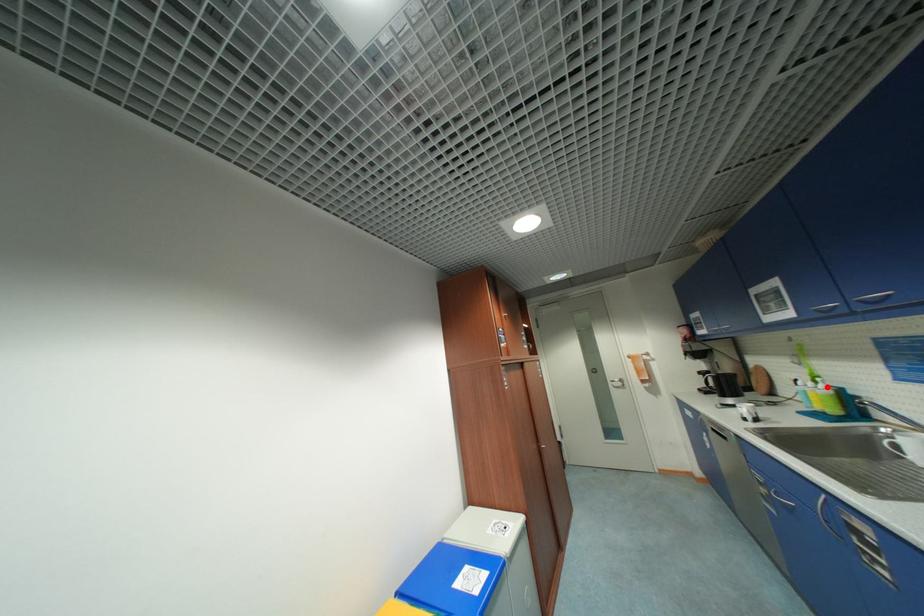
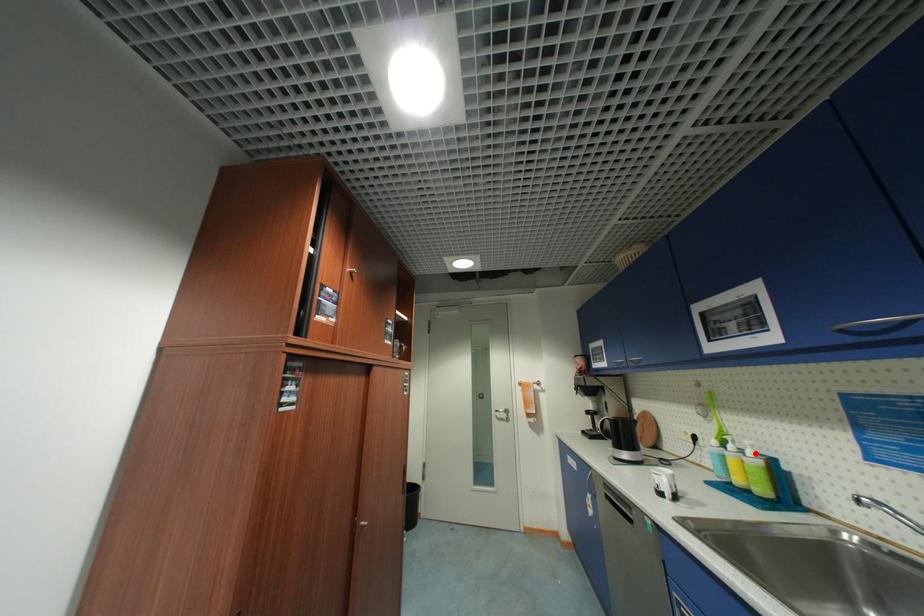
I am providing you with two images of the same scene from different viewpoints. A red point is marked on the first image and another point is marked on the second image. Do the highlighted points in image1 and image2 indicate the same real-world spot?

Yes